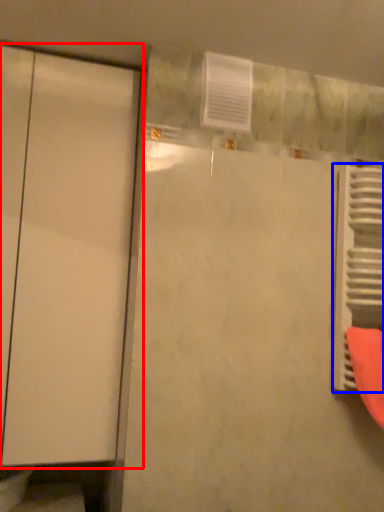
Question: Which object is further to the camera taking this photo, door (highlighted by a red box) or radiator (highlighted by a blue box)?

Choices:
 (A) door
 (B) radiator

Answer: (B)